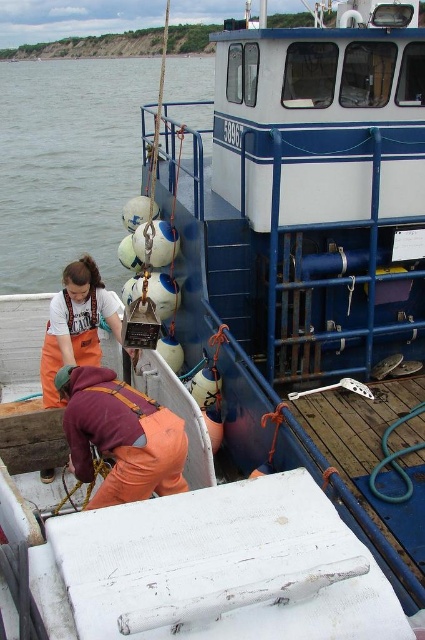
Which is below, white matte water at left or orange fabric at lower center?

orange fabric at lower center is below.

Is white matte water at left below orange fabric at lower center?

No.

Which is behind, point (65, 140) or point (136, 496)?

The point (65, 140) is more distant.

You are a GUI agent. You are given a task and a screenshot of the screen. Output one action in this format:
    pyautogui.click(x=<x>, y=<y>)
    Task: Click on the white matte water at left
    
    Given the screenshot: What is the action you would take?
    pyautogui.click(x=68, y=164)